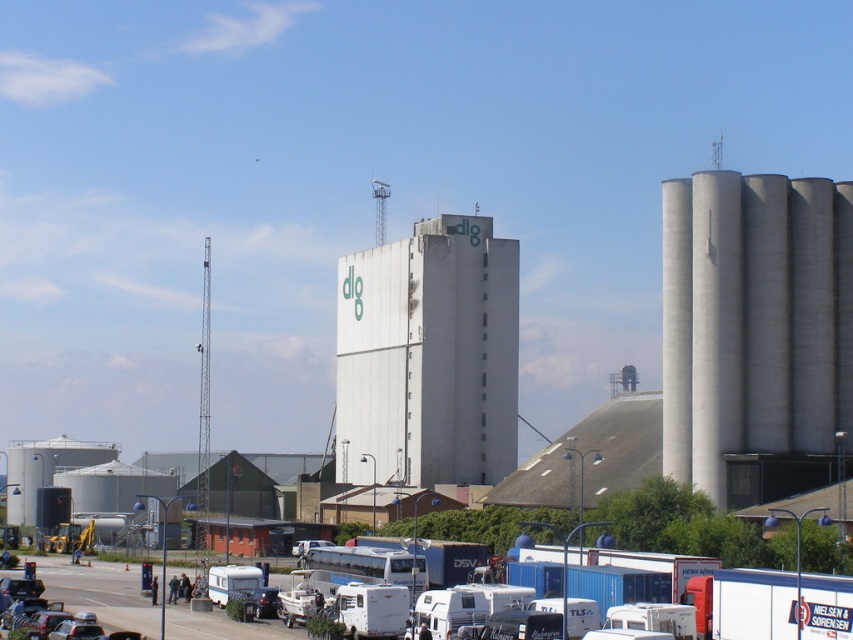
Which is below, white concrete silo at center or white matte camper van at center?

white matte camper van at center is lower down.

Is white concrete silo at center in front of white matte camper van at center?

No.

Find the location of a particular element. white concrete silo at center is located at coordinates (428, 356).

Identify the location of white concrete silo at center. (428, 356).

Can you confirm if gray concrete silo at right is shorter than white matte camper van at center?

Incorrect, gray concrete silo at right's height does not fall short of white matte camper van at center's.

Is gray concrete silo at right positioned before white matte camper van at center?

No.

Image resolution: width=853 pixels, height=640 pixels. What do you see at coordinates (753, 321) in the screenshot?
I see `gray concrete silo at right` at bounding box center [753, 321].

Where is `gray concrete silo at right`? The width and height of the screenshot is (853, 640). gray concrete silo at right is located at coordinates (753, 321).

Which is below, gray concrete silo at right or white concrete silo at center?

white concrete silo at center

Can you confirm if gray concrete silo at right is shorter than white concrete silo at center?

Indeed, gray concrete silo at right has a lesser height compared to white concrete silo at center.

Is point (764, 349) positioned after point (345, 442)?

No, it is in front of (345, 442).

This screenshot has height=640, width=853. I want to click on gray concrete silo at right, so click(x=753, y=321).